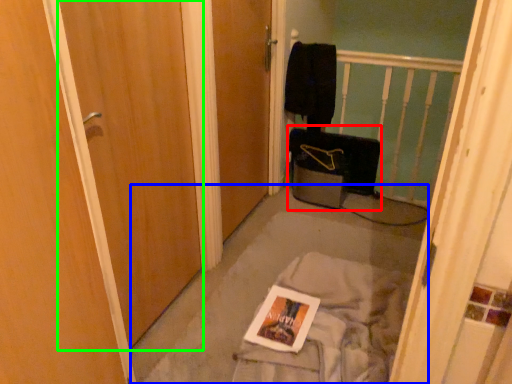
Question: Which object is the closest to the luggage (highlighted by a red box)? Choose among these: concrete (highlighted by a blue box) or door (highlighted by a green box).

Choices:
 (A) concrete
 (B) door

Answer: (A)